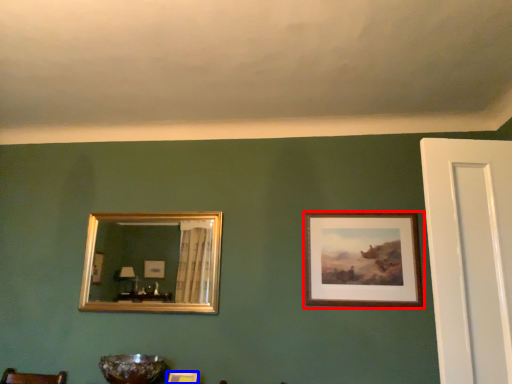
Question: Which object is further to the camera taking this photo, picture frame (highlighted by a red box) or picture frame (highlighted by a blue box)?

Choices:
 (A) picture frame
 (B) picture frame

Answer: (A)